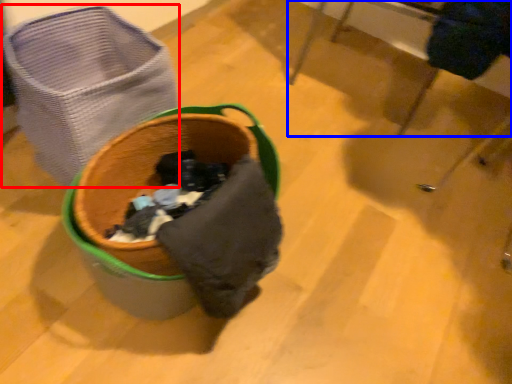
Question: Which of the following is the closest to the observer, laundry basket (highlighted by a red box) or furniture (highlighted by a blue box)?

Choices:
 (A) laundry basket
 (B) furniture

Answer: (A)